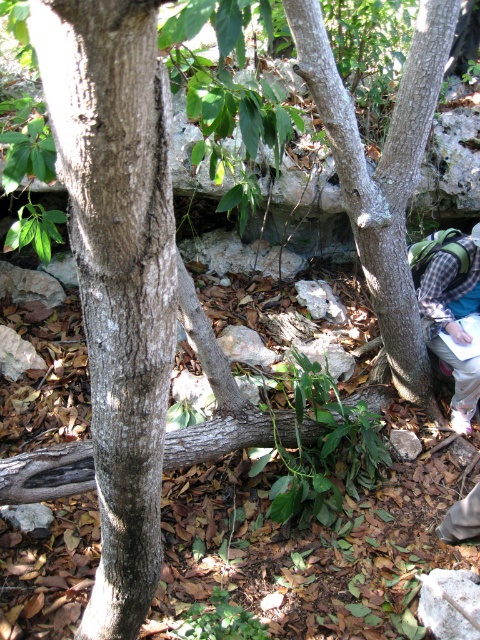
Does smooth bark tree at lower right have a lesser width compared to plaid fabric at lower right?

No, smooth bark tree at lower right is not thinner than plaid fabric at lower right.

What do you see at coordinates (383, 173) in the screenshot? The image size is (480, 640). I see `smooth bark tree at lower right` at bounding box center [383, 173].

At what (x,y) coordinates should I click in order to perform the action: click on smooth bark tree at lower right. Please return your answer as a coordinate pair (x, y). Looking at the image, I should click on (383, 173).

Consider the image. Does plaid fabric at lower right come in front of gray rough stone at lower right?

No, it is not.

The width and height of the screenshot is (480, 640). Identify the location of plaid fabric at lower right. (453, 321).

Locate an element on the screen. The image size is (480, 640). plaid fabric at lower right is located at coordinates (453, 321).

Does smooth bark tree at lower right come behind gray rough stone at lower right?

That is False.

Is smooth bark tree at lower right bigger than gray rough stone at lower right?

Indeed, smooth bark tree at lower right has a larger size compared to gray rough stone at lower right.

Does point (427, 42) lie in front of point (439, 637)?

That is False.

Find the location of a particular element. smooth bark tree at lower right is located at coordinates (383, 173).